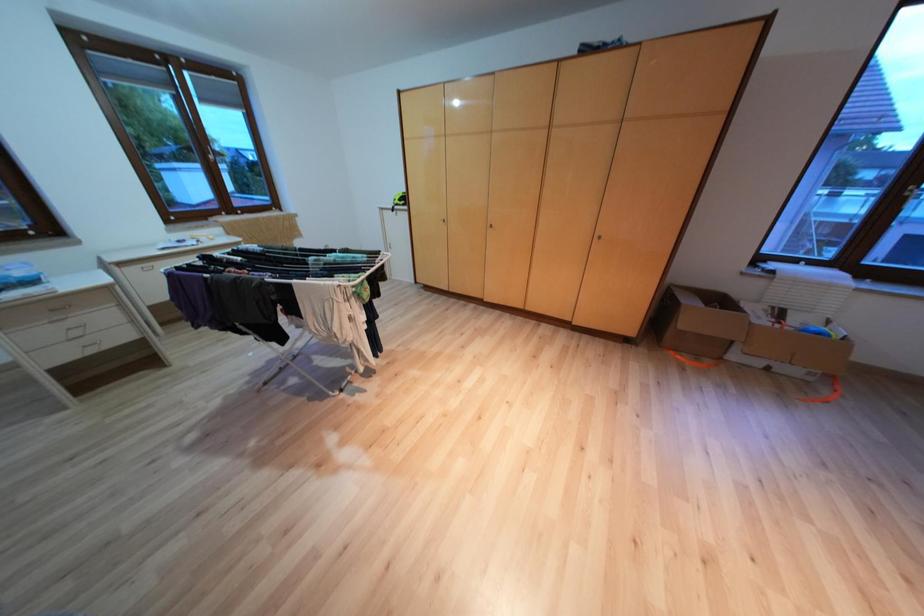
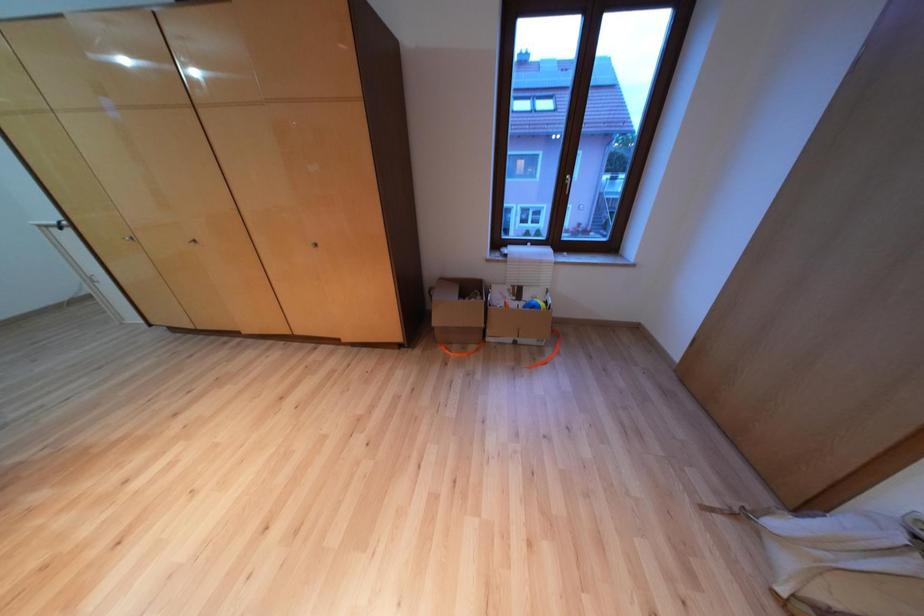
Question: Which direction would the cameraman need to move to produce the second image? Reply with the corresponding letter.

Choices:
 (A) Left
 (B) Right
 (C) Forward
 (D) Backward

Answer: (B)